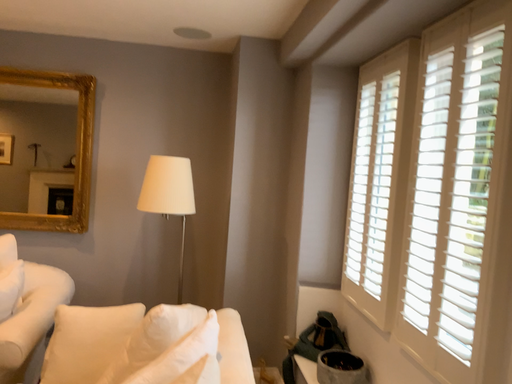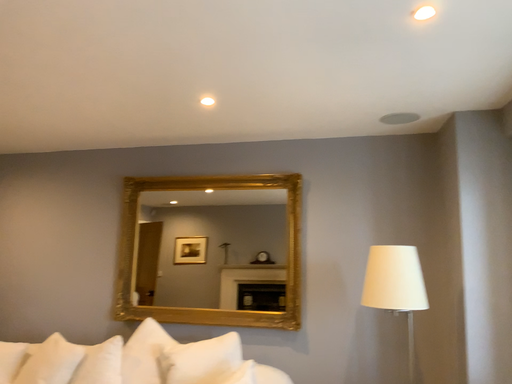
Question: Which way did the camera rotate in the video?

Choices:
 (A) rotated downward
 (B) rotated upward

Answer: (B)